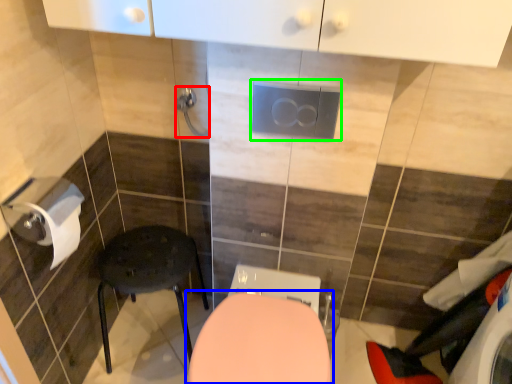
Question: Estimate the real-world distances between objects in this image. Which object is closer to towel bar (highlighted by a red box), toilet (highlighted by a blue box) or electric outlet (highlighted by a green box)?

Choices:
 (A) toilet
 (B) electric outlet

Answer: (B)